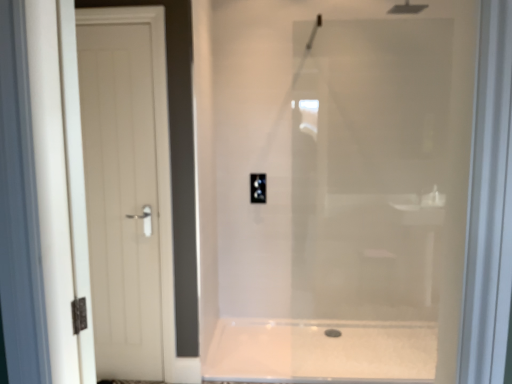
Question: Is white glossy bath at center located outside black plastic outlet at center?

Choices:
 (A) yes
 (B) no

Answer: (A)

Question: Is black plastic outlet at center located within white glossy bath at center?

Choices:
 (A) no
 (B) yes

Answer: (A)

Question: From a real-world perspective, is white glossy bath at center located beneath black plastic outlet at center?

Choices:
 (A) yes
 (B) no

Answer: (A)

Question: Is white glossy bath at center looking in the opposite direction of black plastic outlet at center?

Choices:
 (A) no
 (B) yes

Answer: (A)

Question: Is white glossy bath at center oriented towards black plastic outlet at center?

Choices:
 (A) no
 (B) yes

Answer: (A)

Question: In the image, is white matte door at left on the left side or the right side of black plastic outlet at center?

Choices:
 (A) right
 (B) left

Answer: (B)

Question: From a real-world perspective, is white matte door at left above or below black plastic outlet at center?

Choices:
 (A) above
 (B) below

Answer: (B)

Question: Considering the positions of white matte door at left and black plastic outlet at center in the image, is white matte door at left taller or shorter than black plastic outlet at center?

Choices:
 (A) tall
 (B) short

Answer: (A)

Question: From the image's perspective, relative to black plastic outlet at center, is white matte door at left above or below?

Choices:
 (A) above
 (B) below

Answer: (B)

Question: Considering their positions, is black plastic outlet at center located in front of or behind white glossy bath at center?

Choices:
 (A) front
 (B) behind

Answer: (B)

Question: Is black plastic outlet at center spatially inside white glossy bath at center, or outside of it?

Choices:
 (A) outside
 (B) inside

Answer: (A)

Question: Considering the positions of black plastic outlet at center and white glossy bath at center in the image, is black plastic outlet at center taller or shorter than white glossy bath at center?

Choices:
 (A) short
 (B) tall

Answer: (B)

Question: Is black plastic outlet at center wider or thinner than white glossy bath at center?

Choices:
 (A) thin
 (B) wide

Answer: (A)

Question: Is white glossy bath at center spatially inside white matte door at left, or outside of it?

Choices:
 (A) inside
 (B) outside

Answer: (B)

Question: From a real-world perspective, relative to white matte door at left, is white glossy bath at center vertically above or below?

Choices:
 (A) below
 (B) above

Answer: (A)